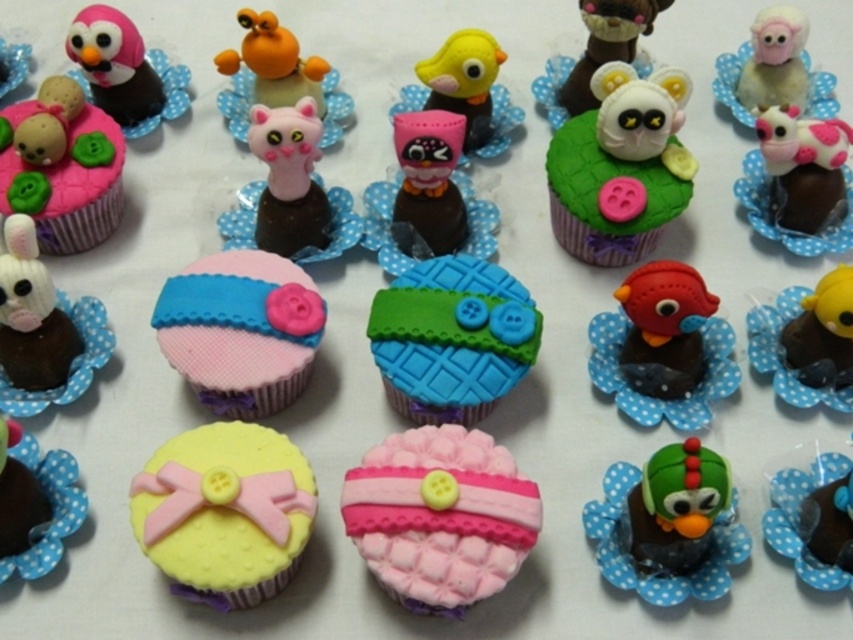
What do you see at coordinates (668, 524) in the screenshot? I see `green matte bird at center` at bounding box center [668, 524].

Looking at this image, does green matte bird at center have a smaller size compared to orange matte toy at upper center?

Actually, green matte bird at center might be larger than orange matte toy at upper center.

Where is `green matte bird at center`? This screenshot has height=640, width=853. green matte bird at center is located at coordinates (668, 524).

Find the location of a particular element. This screenshot has width=853, height=640. green matte bird at center is located at coordinates (x=668, y=524).

Who is shorter, yellow matte cupcake at center-left or matte pink fondant cupcake at upper left?

With less height is yellow matte cupcake at center-left.

Does yellow matte cupcake at center-left appear on the left side of matte pink fondant cupcake at upper left?

No, yellow matte cupcake at center-left is not to the left of matte pink fondant cupcake at upper left.

Locate an element on the screen. This screenshot has height=640, width=853. yellow matte cupcake at center-left is located at coordinates (224, 513).

Does yellow matte cupcake at center-left have a lesser height compared to rubber duck at right?

In fact, yellow matte cupcake at center-left may be taller than rubber duck at right.

Does yellow matte cupcake at center-left have a larger size compared to rubber duck at right?

No, yellow matte cupcake at center-left is not bigger than rubber duck at right.

I want to click on yellow matte cupcake at center-left, so click(x=224, y=513).